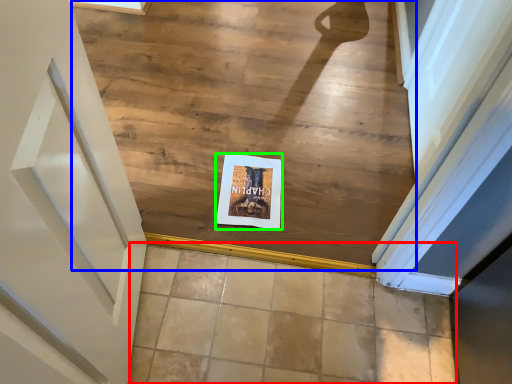
Question: Which is farther away from tile (highlighted by a red box)? stairwell (highlighted by a blue box) or postcard (highlighted by a green box)?

Choices:
 (A) stairwell
 (B) postcard

Answer: (A)